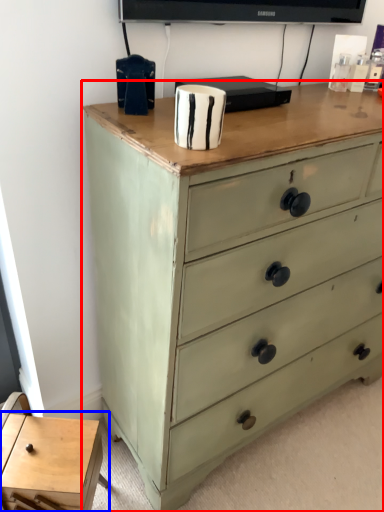
Question: Which of the following is the closest to the observer, chest of drawers (highlighted by a red box) or table (highlighted by a blue box)?

Choices:
 (A) chest of drawers
 (B) table

Answer: (A)